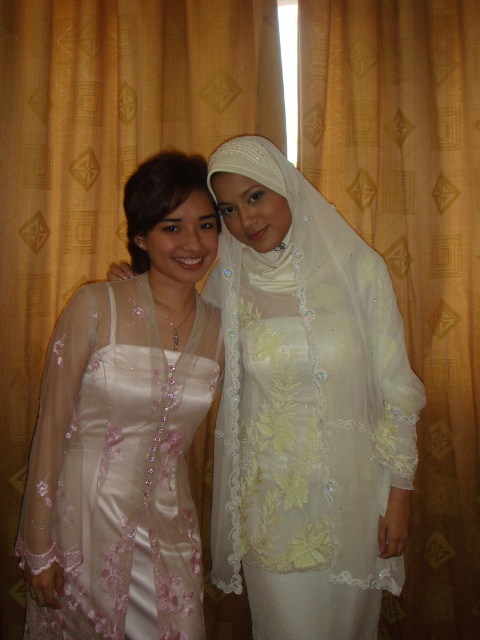
Looking at this image, does satin white dress at center lie in front of satin dress at left?

No.

Which is more to the left, satin white dress at center or satin dress at left?

From the viewer's perspective, satin dress at left appears more on the left side.

Is point (292, 209) farther from viewer compared to point (111, 541)?

That is True.

Find the location of a particular element. The width and height of the screenshot is (480, 640). satin white dress at center is located at coordinates (305, 404).